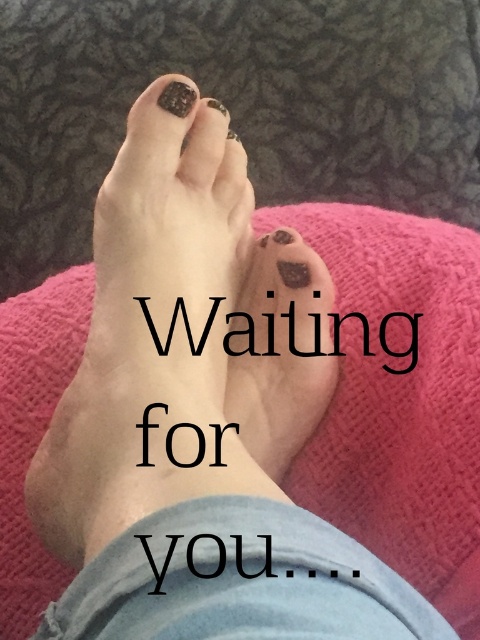
Question: Is matte black nail at upper center positioned at the back of matte black nail at center?

Choices:
 (A) yes
 (B) no

Answer: (B)

Question: Can you confirm if matte black nail at upper center is positioned above matte black nail at center?

Choices:
 (A) no
 (B) yes

Answer: (B)

Question: Can you confirm if matte black nail at center is wider than matte black toe at center?

Choices:
 (A) yes
 (B) no

Answer: (A)

Question: Which is farther from the matte black toenail polish at center?

Choices:
 (A) matte black toenail at center
 (B) matte black nail at upper center
 (C) matte black toe at center

Answer: (B)

Question: Based on their relative distances, which object is nearer to the matte black toenail polish at center?

Choices:
 (A) matte black nail at center
 (B) matte black toe at center

Answer: (B)

Question: Which of these objects is positioned farthest from the matte black nail at upper center?

Choices:
 (A) matte black toenail at center
 (B) matte black nail at center
 (C) matte black toenail polish at center

Answer: (C)